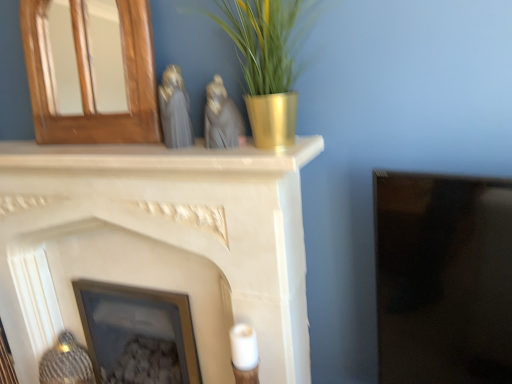
Identify the location of matte gray statue at center, the 2th animal positioned from the left. (222, 118).

The width and height of the screenshot is (512, 384). What do you see at coordinates (158, 243) in the screenshot? I see `white matte fireplace at center, which is counted as the second fireplace, starting from the top` at bounding box center [158, 243].

You are a GUI agent. You are given a task and a screenshot of the screen. Output one action in this format:
    pyautogui.click(x=<x>, y=<y>)
    Task: Click on the matte glass picture frame at center
    
    Given the screenshot: What is the action you would take?
    pyautogui.click(x=137, y=334)

Identify the location of matte gray statue at center, which is the 1th animal in right-to-left order. The height and width of the screenshot is (384, 512). (222, 118).

In the image, there is a matte gray statue at center, the 2th animal positioned from the left. Identify the location of fireplace below it (from the image's perspective). The width and height of the screenshot is (512, 384). (158, 243).

From the picture: From the image's perspective, is white matte fireplace at center, placed as the first fireplace when sorted from bottom to top, located above matte gray statue at center, which is the 1th animal in right-to-left order?

No, from the image's perspective, white matte fireplace at center, placed as the first fireplace when sorted from bottom to top, is not over matte gray statue at center, which is the 1th animal in right-to-left order.

Can you confirm if white matte fireplace at center, placed as the first fireplace when sorted from bottom to top, is wider than matte gray statue at center, which is the 1th animal in right-to-left order?

Indeed, white matte fireplace at center, placed as the first fireplace when sorted from bottom to top, has a greater width compared to matte gray statue at center, which is the 1th animal in right-to-left order.

Consider the image. Can you confirm if matte gray statue at center, which is the 1th animal in right-to-left order, is bigger than matte glass picture frame at center?

Actually, matte gray statue at center, which is the 1th animal in right-to-left order, might be smaller than matte glass picture frame at center.

Considering the points (216, 144) and (178, 344), which point is in front, point (216, 144) or point (178, 344)?

Positioned in front is point (216, 144).

From a real-world perspective, is matte gray statue at center, which is the 1th animal in right-to-left order, positioned above or below matte glass picture frame at center?

matte gray statue at center, which is the 1th animal in right-to-left order, is above matte glass picture frame at center.

Locate an element on the screen. This screenshot has width=512, height=384. picture frame behind the matte gray statue at center, the 2th animal positioned from the left is located at coordinates (137, 334).

From a real-world perspective, is wooden mirror at upper left, which appears as the 1th fireplace when viewed from the top, beneath matte glass picture frame at center?

No, from a real-world perspective, wooden mirror at upper left, which appears as the 1th fireplace when viewed from the top, is not below matte glass picture frame at center.

Can you confirm if wooden mirror at upper left, the 2th fireplace ordered from the bottom, is bigger than matte glass picture frame at center?

Actually, wooden mirror at upper left, the 2th fireplace ordered from the bottom, might be smaller than matte glass picture frame at center.

Starting from the matte glass picture frame at center, which fireplace is the 2nd one to the left? Please provide its 2D coordinates.

[(91, 79)]

What's the angular difference between wooden mirror at upper left, which appears as the 1th fireplace when viewed from the top, and matte glass picture frame at center's facing directions?

1.1 degrees separate the facing orientations of wooden mirror at upper left, which appears as the 1th fireplace when viewed from the top, and matte glass picture frame at center.

Is matte gray statue at center, the 2th animal positioned from the left, directly adjacent to wooden mirror at upper left, the 2th fireplace ordered from the bottom?

No, matte gray statue at center, the 2th animal positioned from the left, is not with wooden mirror at upper left, the 2th fireplace ordered from the bottom.

Is wooden mirror at upper left, which appears as the 1th fireplace when viewed from the top, at the back of matte gray statue at center, the 2th animal positioned from the left?

No.

Who is more distant, matte gray statue at center, the 2th animal positioned from the left, or wooden mirror at upper left, the 2th fireplace ordered from the bottom?

wooden mirror at upper left, the 2th fireplace ordered from the bottom, is further away from the camera.

From a real-world perspective, is matte gray statue at center, the 2th animal positioned from the left, on top of wooden mirror at upper left, the 2th fireplace ordered from the bottom?

Incorrect, from a real-world perspective, matte gray statue at center, the 2th animal positioned from the left, is lower than wooden mirror at upper left, the 2th fireplace ordered from the bottom.

How much distance is there between wooden mirror at upper left, which appears as the 1th fireplace when viewed from the top, and white matte fireplace at center, which is counted as the second fireplace, starting from the top?

wooden mirror at upper left, which appears as the 1th fireplace when viewed from the top, and white matte fireplace at center, which is counted as the second fireplace, starting from the top, are 33.20 centimeters apart from each other.

Consider the image. Which object is more forward, wooden mirror at upper left, which appears as the 1th fireplace when viewed from the top, or white matte fireplace at center, which is counted as the second fireplace, starting from the top?

Positioned in front is white matte fireplace at center, which is counted as the second fireplace, starting from the top.

Is white matte fireplace at center, placed as the first fireplace when sorted from bottom to top, a part of wooden mirror at upper left, which appears as the 1th fireplace when viewed from the top?

Definitely not — white matte fireplace at center, placed as the first fireplace when sorted from bottom to top, is not inside wooden mirror at upper left, which appears as the 1th fireplace when viewed from the top.

Which point is more distant from viewer, (37, 30) or (268, 356)?

The point (37, 30) is farther from the camera.

From the image's perspective, which is above, matte glass picture frame at center or satin gray statue at center, the 1th animal in the left-to-right sequence?

satin gray statue at center, the 1th animal in the left-to-right sequence, is shown above in the image.

Which is in front, point (105, 290) or point (168, 122)?

Positioned in front is point (168, 122).

Is matte glass picture frame at center looking in the opposite direction of satin gray statue at center, which appears as the 2th animal when viewed from the right?

matte glass picture frame at center is not turned away from satin gray statue at center, which appears as the 2th animal when viewed from the right.

Considering the sizes of objects matte glass picture frame at center and satin gray statue at center, the 1th animal in the left-to-right sequence, in the image provided, who is bigger, matte glass picture frame at center or satin gray statue at center, the 1th animal in the left-to-right sequence,?

With larger size is matte glass picture frame at center.

How many degrees apart are the facing directions of satin gray statue at center, the 1th animal in the left-to-right sequence, and white matte fireplace at center, placed as the first fireplace when sorted from bottom to top?

0.0013 degrees.

Would you say satin gray statue at center, which appears as the 2th animal when viewed from the right, is a long distance from white matte fireplace at center, which is counted as the second fireplace, starting from the top?

No, satin gray statue at center, which appears as the 2th animal when viewed from the right, is not far away from white matte fireplace at center, which is counted as the second fireplace, starting from the top.

Based on the photo, considering the sizes of objects satin gray statue at center, which appears as the 2th animal when viewed from the right, and white matte fireplace at center, placed as the first fireplace when sorted from bottom to top, in the image provided, who is wider, satin gray statue at center, which appears as the 2th animal when viewed from the right, or white matte fireplace at center, placed as the first fireplace when sorted from bottom to top,?

white matte fireplace at center, placed as the first fireplace when sorted from bottom to top, is wider.

Is satin gray statue at center, the 1th animal in the left-to-right sequence, located outside white matte fireplace at center, which is counted as the second fireplace, starting from the top?

satin gray statue at center, the 1th animal in the left-to-right sequence, is positioned outside white matte fireplace at center, which is counted as the second fireplace, starting from the top.

Where is `animal located in front of the white matte fireplace at center, which is counted as the second fireplace, starting from the top`? This screenshot has width=512, height=384. animal located in front of the white matte fireplace at center, which is counted as the second fireplace, starting from the top is located at coordinates (222, 118).

At what (x,y) coordinates should I click in order to perform the action: click on the 2nd animal to the right when counting from the matte glass picture frame at center. Please return your answer as a coordinate pair (x, y). The width and height of the screenshot is (512, 384). Looking at the image, I should click on click(222, 118).

Estimate the real-world distances between objects in this image. Which object is further from satin gray statue at center, which appears as the 2th animal when viewed from the right, white matte fireplace at center, placed as the first fireplace when sorted from bottom to top, or wooden mirror at upper left, which appears as the 1th fireplace when viewed from the top?

Among the two, white matte fireplace at center, placed as the first fireplace when sorted from bottom to top, is located further to satin gray statue at center, which appears as the 2th animal when viewed from the right.

Considering their positions, is matte gray statue at center, the 2th animal positioned from the left, positioned closer to white matte fireplace at center, which is counted as the second fireplace, starting from the top, than wooden mirror at upper left, which appears as the 1th fireplace when viewed from the top?

Among the two, wooden mirror at upper left, which appears as the 1th fireplace when viewed from the top, is located nearer to white matte fireplace at center, which is counted as the second fireplace, starting from the top.

From the image, which object appears to be farther from matte gray statue at center, the 2th animal positioned from the left, matte glass picture frame at center or white matte fireplace at center, which is counted as the second fireplace, starting from the top?

matte glass picture frame at center is positioned further to the anchor matte gray statue at center, the 2th animal positioned from the left.

Considering their positions, is matte glass picture frame at center positioned closer to satin gray statue at center, which appears as the 2th animal when viewed from the right, than white matte fireplace at center, which is counted as the second fireplace, starting from the top?

Based on the image, white matte fireplace at center, which is counted as the second fireplace, starting from the top, appears to be nearer to satin gray statue at center, which appears as the 2th animal when viewed from the right.

Based on the photo, when comparing their distances from matte glass picture frame at center, does satin gray statue at center, which appears as the 2th animal when viewed from the right, or matte gray statue at center, the 2th animal positioned from the left, seem closer?

Based on the image, satin gray statue at center, which appears as the 2th animal when viewed from the right, appears to be nearer to matte glass picture frame at center.

From the picture: When comparing their distances from matte gray statue at center, which is the 1th animal in right-to-left order, does satin gray statue at center, the 1th animal in the left-to-right sequence, or matte glass picture frame at center seem closer?

satin gray statue at center, the 1th animal in the left-to-right sequence, is closer to matte gray statue at center, which is the 1th animal in right-to-left order.

Which object lies nearer to the anchor point satin gray statue at center, the 1th animal in the left-to-right sequence, wooden mirror at upper left, the 2th fireplace ordered from the bottom, or white matte fireplace at center, placed as the first fireplace when sorted from bottom to top?

Based on the image, wooden mirror at upper left, the 2th fireplace ordered from the bottom, appears to be nearer to satin gray statue at center, the 1th animal in the left-to-right sequence.

From the image, which object appears to be farther from matte gray statue at center, which is the 1th animal in right-to-left order, satin gray statue at center, the 1th animal in the left-to-right sequence, or wooden mirror at upper left, the 2th fireplace ordered from the bottom?

wooden mirror at upper left, the 2th fireplace ordered from the bottom, is positioned further to the anchor matte gray statue at center, which is the 1th animal in right-to-left order.

In order to click on fireplace between satin gray statue at center, which appears as the 2th animal when viewed from the right, and matte glass picture frame at center in the up-down direction in this screenshot , I will do `click(158, 243)`.

Locate an element on the screen. This screenshot has height=384, width=512. animal between wooden mirror at upper left, which appears as the 1th fireplace when viewed from the top, and matte gray statue at center, which is the 1th animal in right-to-left order, from left to right is located at coordinates (175, 109).

This screenshot has height=384, width=512. I want to click on fireplace that lies between matte gray statue at center, which is the 1th animal in right-to-left order, and matte glass picture frame at center from top to bottom, so click(x=158, y=243).

At what (x,y) coordinates should I click in order to perform the action: click on fireplace that lies between wooden mirror at upper left, the 2th fireplace ordered from the bottom, and matte glass picture frame at center from top to bottom. Please return your answer as a coordinate pair (x, y). The image size is (512, 384). Looking at the image, I should click on (158, 243).